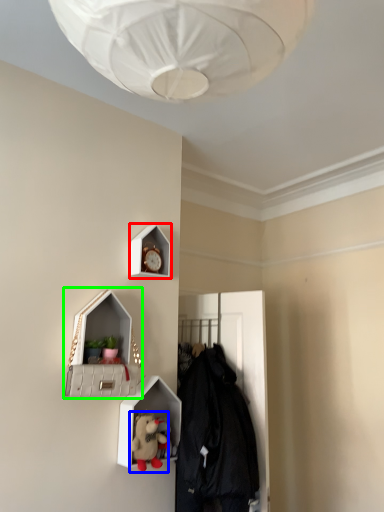
Question: Which is nearer to the clock (highlighted by a red box)? toy (highlighted by a blue box) or medicine cabinet (highlighted by a green box).

Choices:
 (A) toy
 (B) medicine cabinet

Answer: (B)